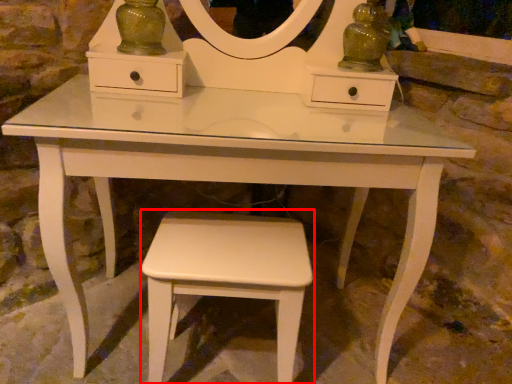
Question: Where is stool (annotated by the red box) located in relation to glass vase in the image?

Choices:
 (A) left
 (B) right

Answer: (B)